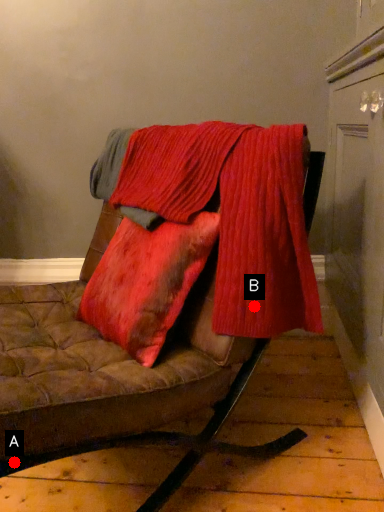
Question: Two points are circled on the image, labeled by A and B beside each circle. Which point is farther from the camera taking this photo?

Choices:
 (A) A is further
 (B) B is further

Answer: (B)